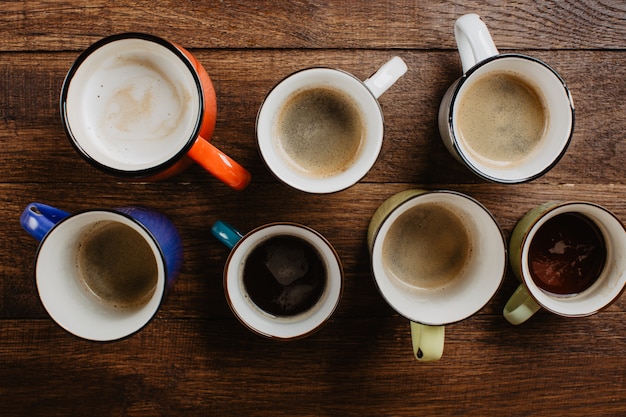
You are a GUI agent. You are given a task and a screenshot of the screen. Output one action in this format:
    pyautogui.click(x=<x>, y=<y>)
    Task: Click on the coffee cups
    The height and width of the screenshot is (417, 626).
    Given the screenshot: What is the action you would take?
    pyautogui.click(x=145, y=113), pyautogui.click(x=118, y=276), pyautogui.click(x=342, y=123), pyautogui.click(x=449, y=251), pyautogui.click(x=541, y=246), pyautogui.click(x=491, y=108), pyautogui.click(x=230, y=288)